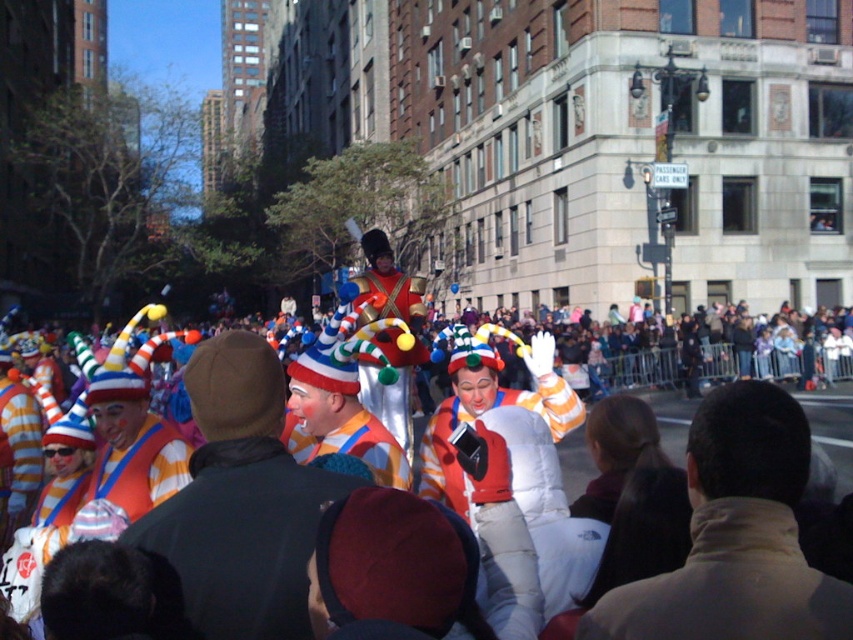
You are a photographer trying to capture the striped fabric clown at center and the matte clown costume at center in a single shot. Which clown should you focus on to ensure both are in the frame without moving the camera?

You should focus on the striped fabric clown at center because it is in front of the matte clown costume at center, so keeping the focus on the foreground clown will help both remain in the frame.

You are standing in the middle of the lively street scene described. You want to reach the matte white balloon at center to pop it. Considering your average walking speed is 1.5 meters per second, how many seconds will it take you to reach the balloon?

The distance between the matte white balloon at center and the viewer is 9.83 meters. At a walking speed of 1.5 meters per second, it would take approximately 6.55 seconds to reach the balloon.